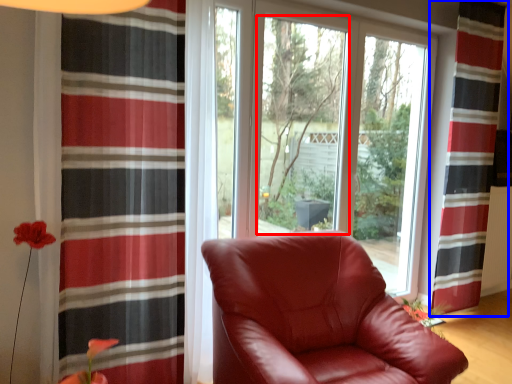
Question: Which of the following is the farthest to the observer, window screen (highlighted by a red box) or curtain (highlighted by a blue box)?

Choices:
 (A) window screen
 (B) curtain

Answer: (B)